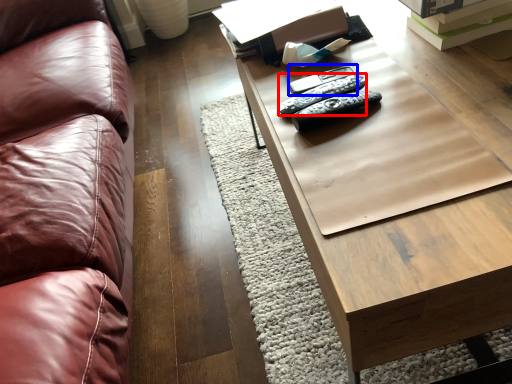
Question: Which point is closer to the camera, remote (highlighted by a red box) or remote (highlighted by a blue box)?

Choices:
 (A) remote
 (B) remote

Answer: (A)